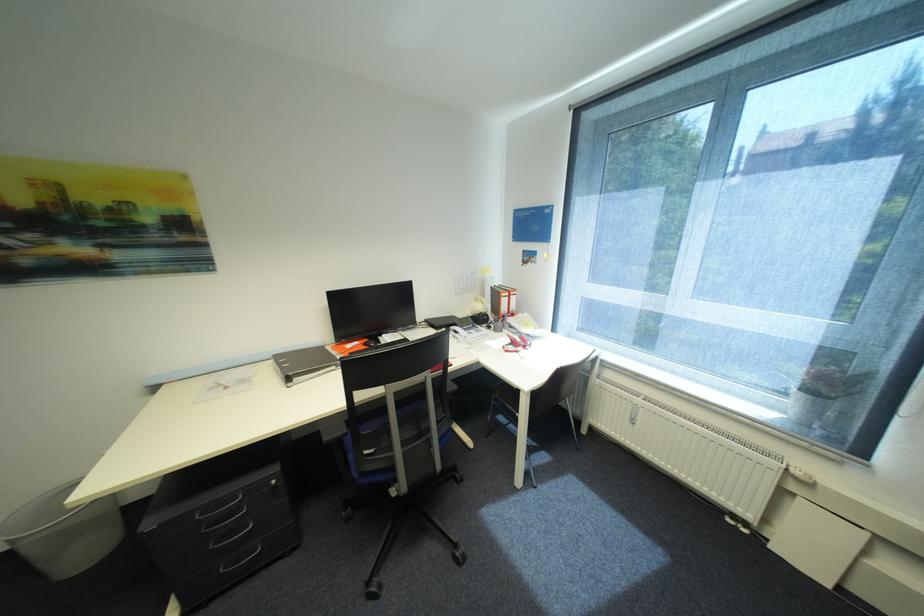
Locate an element on the screen. This screenshot has height=616, width=924. white window handle is located at coordinates (546, 257).